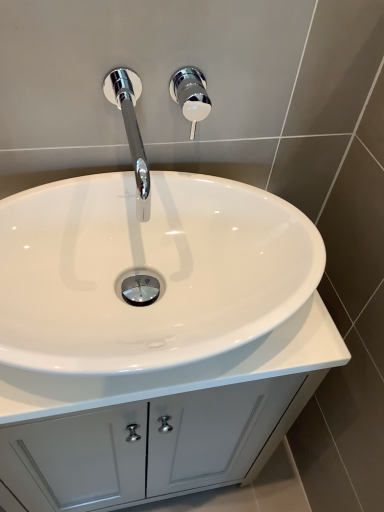
Question: Is white glossy sink at center bigger or smaller than chrome/polished metal shower handle at upper center?

Choices:
 (A) big
 (B) small

Answer: (A)

Question: Looking at their shapes, would you say white glossy sink at center is wider or thinner than chrome/polished metal shower handle at upper center?

Choices:
 (A) wide
 (B) thin

Answer: (A)

Question: Considering the real-world distances, which object is farthest from the chrome/metallic faucet at upper center?

Choices:
 (A) white glossy cabinet at center
 (B) chrome/polished metal shower handle at upper center
 (C) white glossy sink at center

Answer: (A)

Question: Which is nearer to the chrome/metallic faucet at upper center?

Choices:
 (A) white glossy sink at center
 (B) white glossy cabinet at center
 (C) chrome/polished metal shower handle at upper center

Answer: (C)